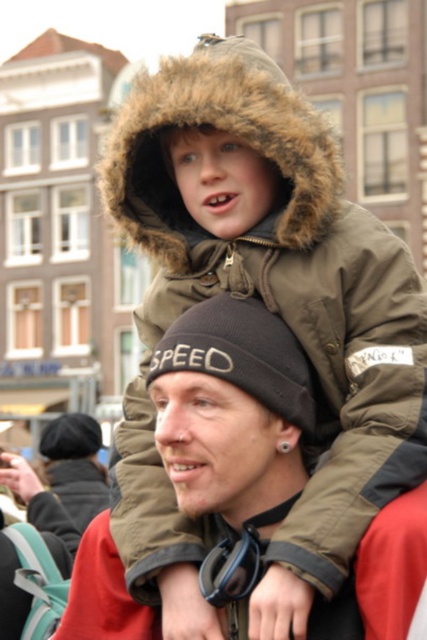
You are standing in the public square and want to take a photo of both the person with the black beanie and the child on their shoulders. Which point, point 1 at coordinates point (370,401) or point 2 at coordinates point (222,602), is closer to you and should be prioritized in your framing?

Point 1 at coordinates point (370,401) is closer to you and should be prioritized in your framing because it is further to the viewer than point 2 at coordinates point (222,602).